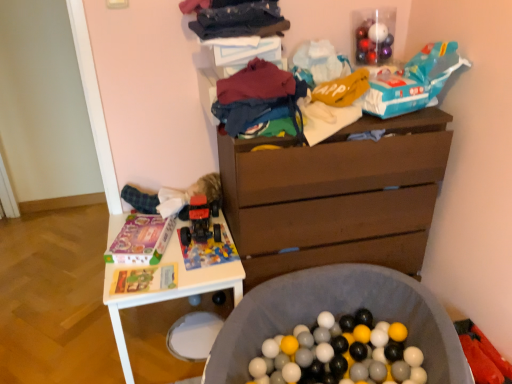
Where is `vacant space in front of rubberized plastic toy car at center, the 2th toy ordered from the bottom`? Image resolution: width=512 pixels, height=384 pixels. vacant space in front of rubberized plastic toy car at center, the 2th toy ordered from the bottom is located at coordinates (196, 260).